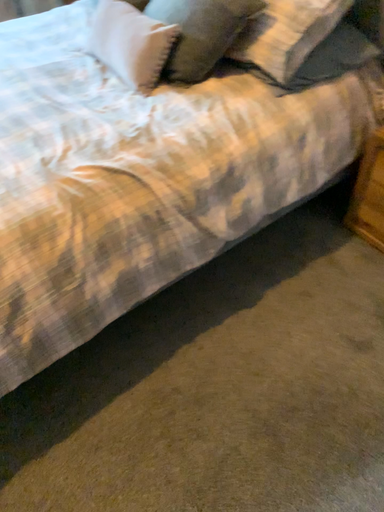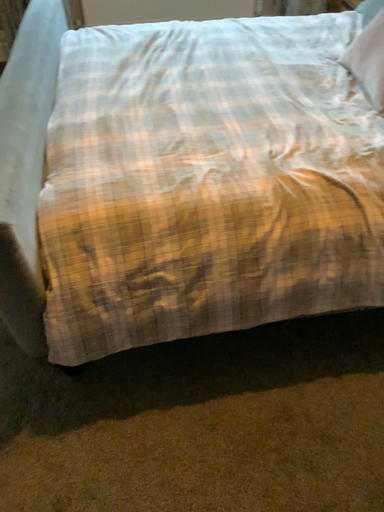
Question: How did the camera likely rotate when shooting the video?

Choices:
 (A) rotated right
 (B) rotated left

Answer: (B)